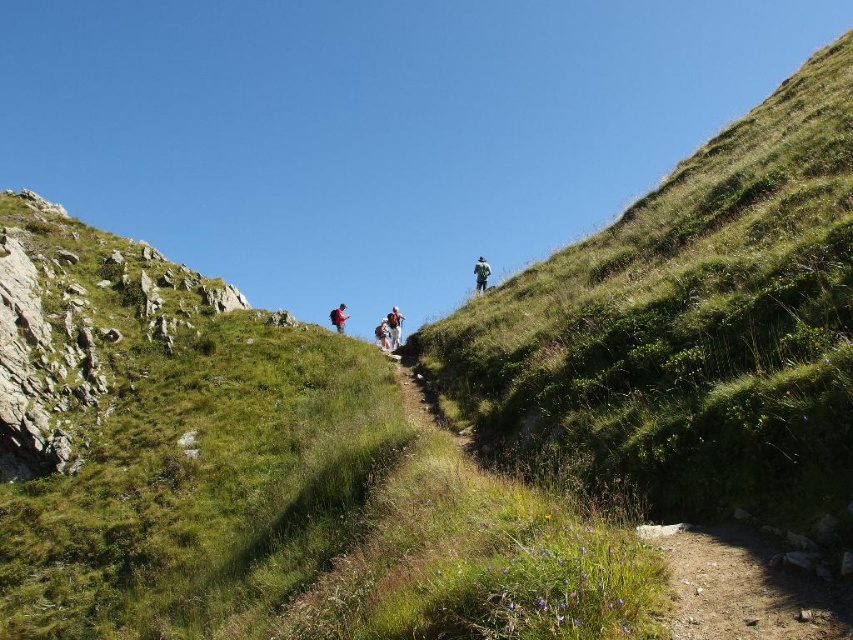
Question: Is green grassy hillside at upper center to the right of green fabric backpack at upper center from the viewer's perspective?

Choices:
 (A) no
 (B) yes

Answer: (A)

Question: Which object is positioned farthest from the light brown leather backpack at center?

Choices:
 (A) matte black backpack at center
 (B) green grassy hillside at upper center

Answer: (A)

Question: Observing the image, what is the correct spatial positioning of green grassy hillside at upper center in reference to light brown leather backpack at center?

Choices:
 (A) right
 (B) left

Answer: (A)

Question: Among these objects, which one is farthest from the camera?

Choices:
 (A) light brown leather backpack at center
 (B) green grassy hillside at upper center
 (C) matte black backpack at center
 (D) dirt path at lower right

Answer: (A)

Question: Is dirt path at lower right to the left of green fabric backpack at upper center from the viewer's perspective?

Choices:
 (A) no
 (B) yes

Answer: (B)

Question: Estimate the real-world distances between objects in this image. Which object is closer to the green fabric backpack at upper center?

Choices:
 (A) matte black backpack at center
 (B) green grassy hillside at upper center
 (C) light brown leather backpack at center
 (D) dirt path at lower right

Answer: (B)